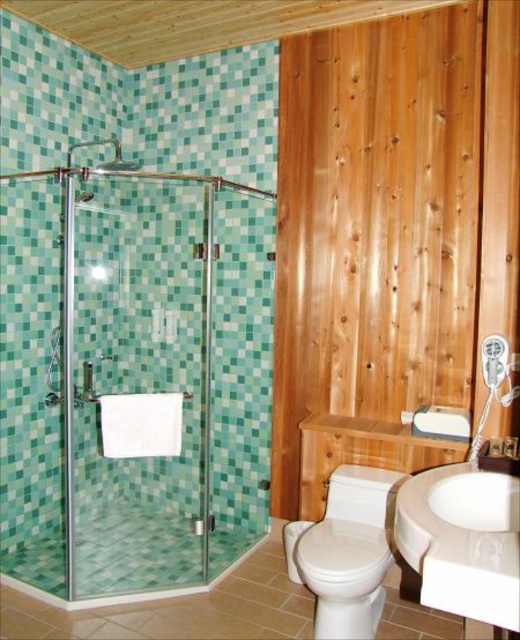
You are a plumber inspecting the bathroom layout. You need to determine if the white glossy toilet at lower center can be replaced with a larger model without affecting the clear glass shower door at left. Based on their sizes, what is your assessment?

The white glossy toilet at lower center is smaller than the clear glass shower door at left. Replacing it with a larger model may require adjusting the space allocated to the clear glass shower door at left to ensure both fit properly.

You are designing a bathroom layout and need to place a new plant stand next to the white glossy sink at lower right. Considering the size of the sink and the clear glass shower door at left, will the plant stand fit comfortably between them?

The white glossy sink at lower right has a smaller size compared to clear glass shower door at left, so there should be enough space for the plant stand between them.